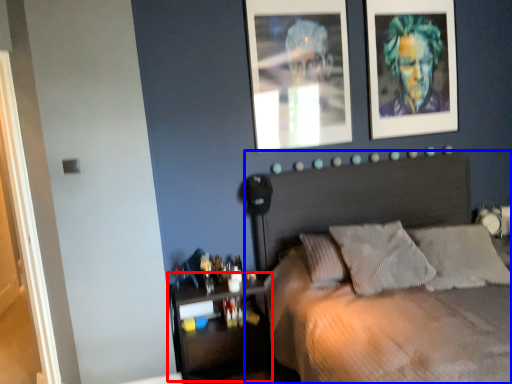
Question: Which of the following is the closest to the observer, shelf (highlighted by a red box) or bed (highlighted by a blue box)?

Choices:
 (A) shelf
 (B) bed

Answer: (B)